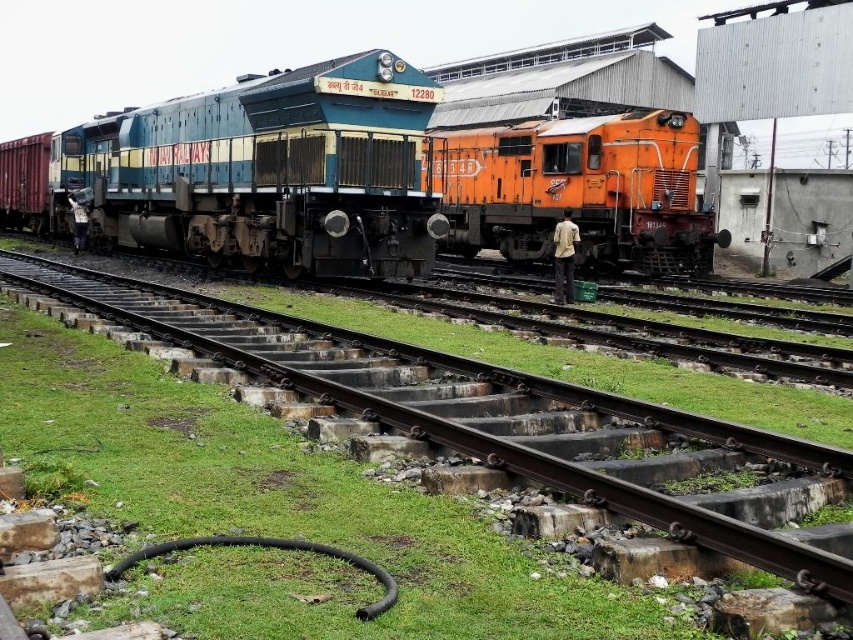
Question: Which of the following is the closest to the observer?

Choices:
 (A) orange metallic train at right
 (B) green grass at lower left
 (C) blue metallic locomotive at center

Answer: (B)

Question: Which object is farther from the camera taking this photo?

Choices:
 (A) orange metallic train at right
 (B) blue metallic locomotive at center

Answer: (A)

Question: Can you confirm if orange metallic train at right is wider than green grass at lower left?

Choices:
 (A) no
 (B) yes

Answer: (A)

Question: Which object is positioned farthest from the green grass at lower left?

Choices:
 (A) blue metallic locomotive at center
 (B) orange metallic train at right

Answer: (B)

Question: Can you confirm if orange metallic train at right is thinner than green grass at lower left?

Choices:
 (A) yes
 (B) no

Answer: (A)

Question: Can you confirm if blue metallic locomotive at center is smaller than green grass at lower left?

Choices:
 (A) yes
 (B) no

Answer: (B)